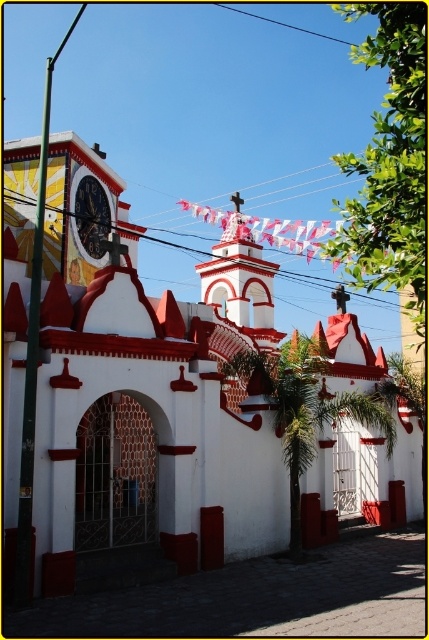
You are an architect examining the building design. You notice the white matte church at center and the black wire at upper center. Which of these two elements appears to be larger in the image?

The white matte church at center is smaller than the black wire at upper center, so the black wire at upper center appears larger.

You are standing in front of the church and want to take a photo of the white painted stucco bell tower at center and the metallic clock face at upper left. Which object will appear larger in your photo?

The white painted stucco bell tower at center will appear larger in your photo because it is much taller than the metallic clock face at upper left.

You are standing in front of the building and notice a specific point marked at coordinates (148,403). Based on the scene description, what object or architectural feature does this point most likely correspond to?

The point at coordinates (148,403) corresponds to the white matte church at center as described in the scene.